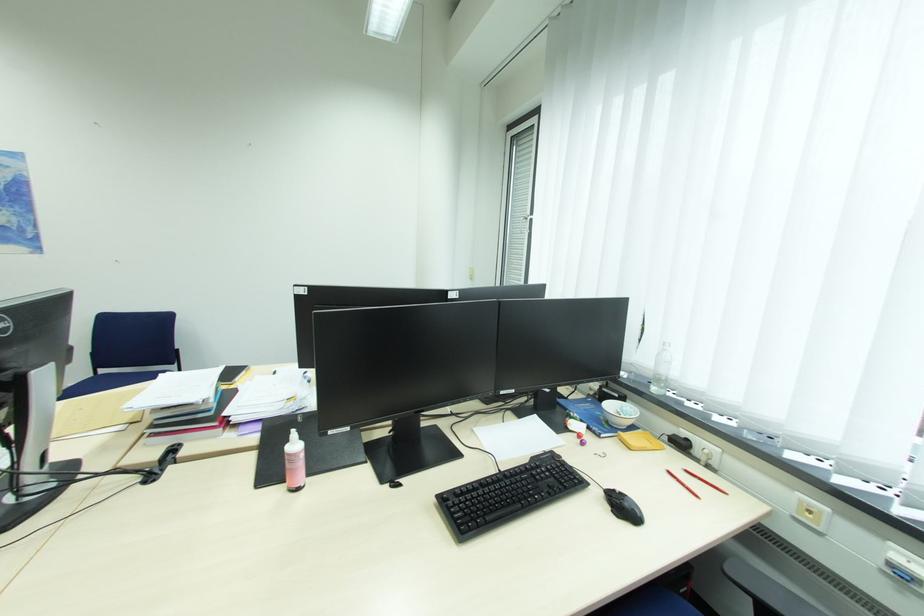
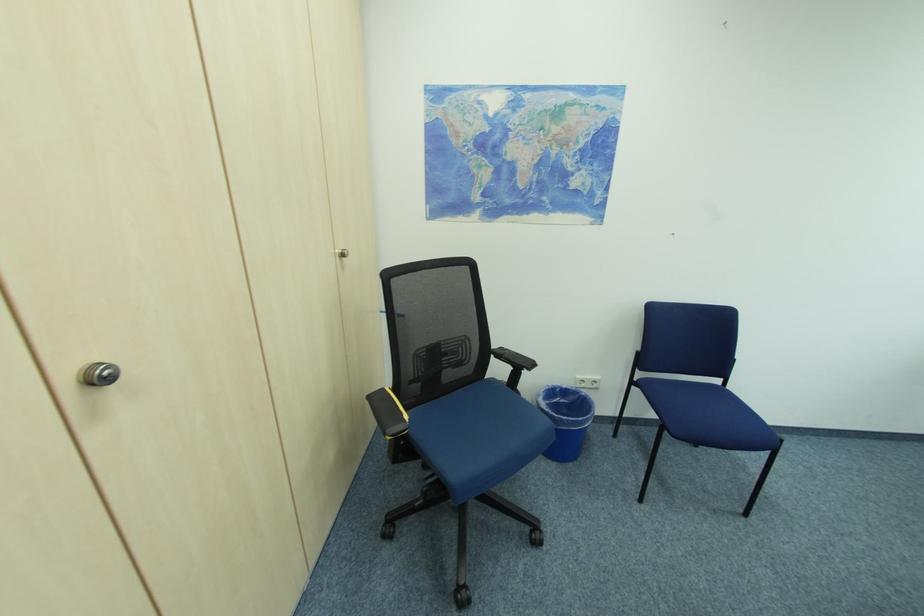
Question: In a continuous first-person perspective shot, in which direction is the camera moving?

Choices:
 (A) Left
 (B) Right
 (C) Forward
 (D) Backward

Answer: (A)